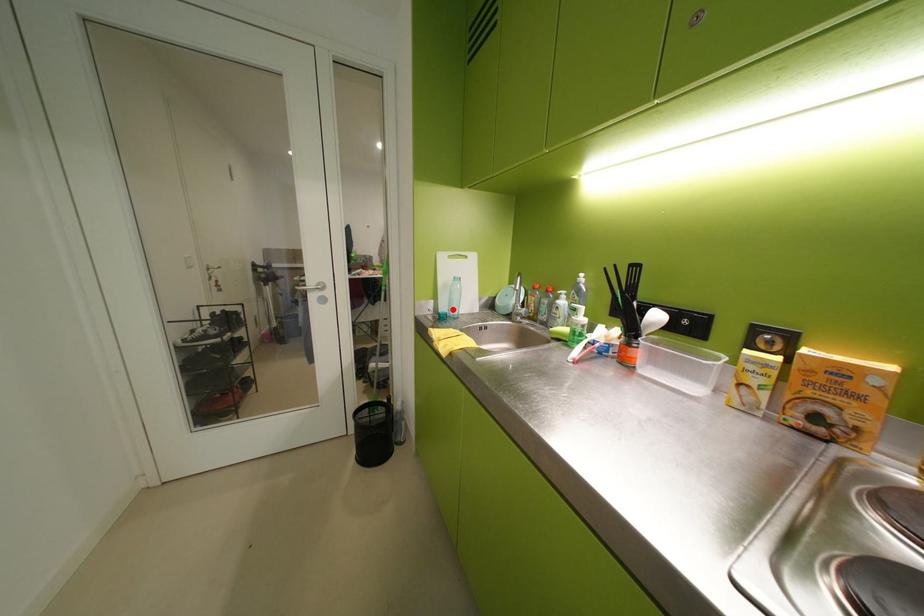
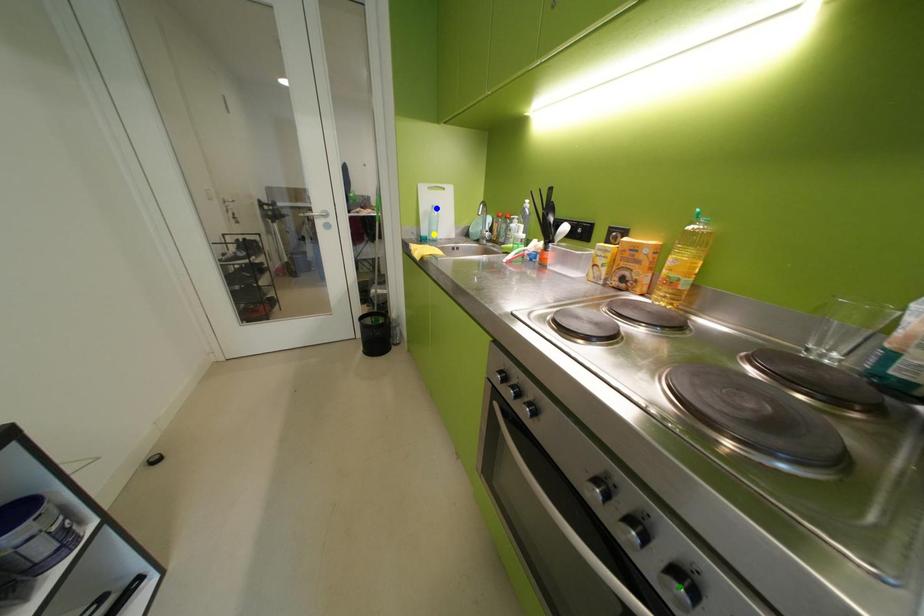
Question: I am providing you with two images of the same scene from different viewpoints. A red point is marked on the first image. You are given multiple points on the second image. In image 2, which mark is for the same physical point as the one in image 1?

Choices:
 (A) green point
 (B) yellow point
 (C) blue point

Answer: (B)